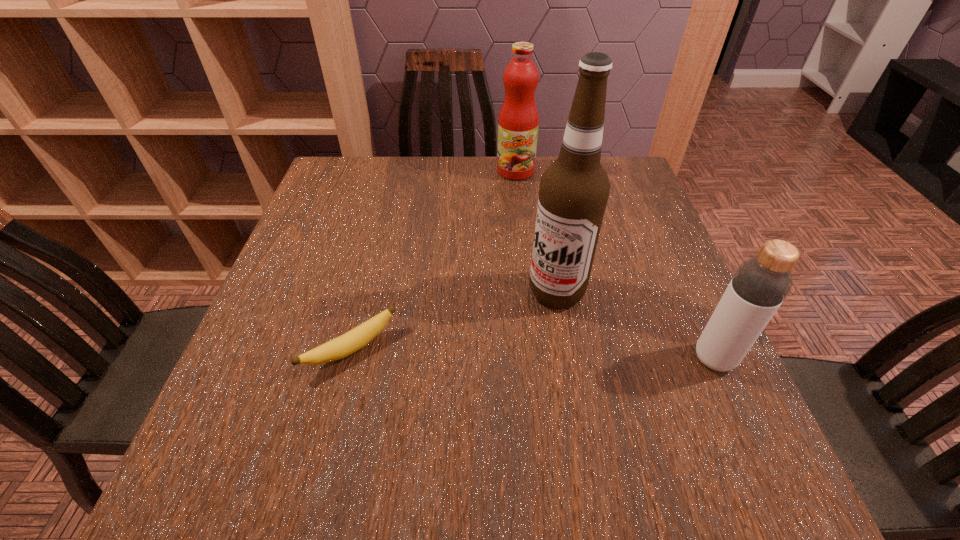
What are the coordinates of `vacant space at the left edge of the desktop` in the screenshot? It's located at (354, 218).

Identify the location of free space at the right edge of the desktop. This screenshot has width=960, height=540. (696, 366).

In the image, there is a desktop. At what (x,y) coordinates should I click in order to perform the action: click on vacant space at the far left corner. Please return your answer as a coordinate pair (x, y). The width and height of the screenshot is (960, 540). Looking at the image, I should click on (353, 197).

Locate an element on the screen. free region at the far right corner of the desktop is located at coordinates (603, 160).

In the image, there is a desktop. Where is `vacant space at the near right corner`? vacant space at the near right corner is located at coordinates (693, 397).

Find the location of a particular element. This screenshot has width=960, height=540. vacant space that is in between the leftmost object and the tallest object is located at coordinates (454, 321).

You are a GUI agent. You are given a task and a screenshot of the screen. Output one action in this format:
    pyautogui.click(x=<x>, y=<y>)
    Task: Click on the empty space between the farthest object and the second shortest object
    The height and width of the screenshot is (540, 960).
    Given the screenshot: What is the action you would take?
    pyautogui.click(x=614, y=265)

This screenshot has width=960, height=540. I want to click on free area in between the alcohol and the third tallest object, so click(x=636, y=325).

The height and width of the screenshot is (540, 960). I want to click on vacant point located between the second shortest object and the third nearest object, so click(x=636, y=325).

You are a GUI agent. You are given a task and a screenshot of the screen. Output one action in this format:
    pyautogui.click(x=<x>, y=<y>)
    Task: Click on the free space between the fruit juice and the leftmost object
    
    Given the screenshot: What is the action you would take?
    pyautogui.click(x=434, y=260)